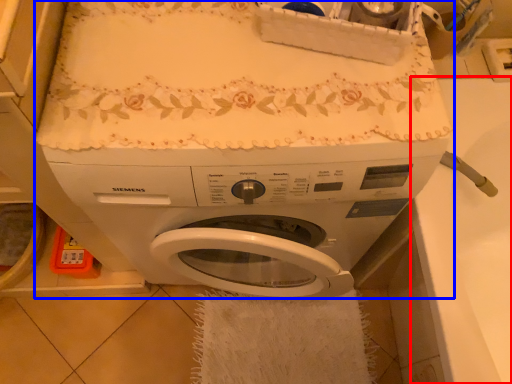
Question: Among these objects, which one is farthest to the camera, counter top (highlighted by a red box) or washing machine (highlighted by a blue box)?

Choices:
 (A) counter top
 (B) washing machine

Answer: (A)